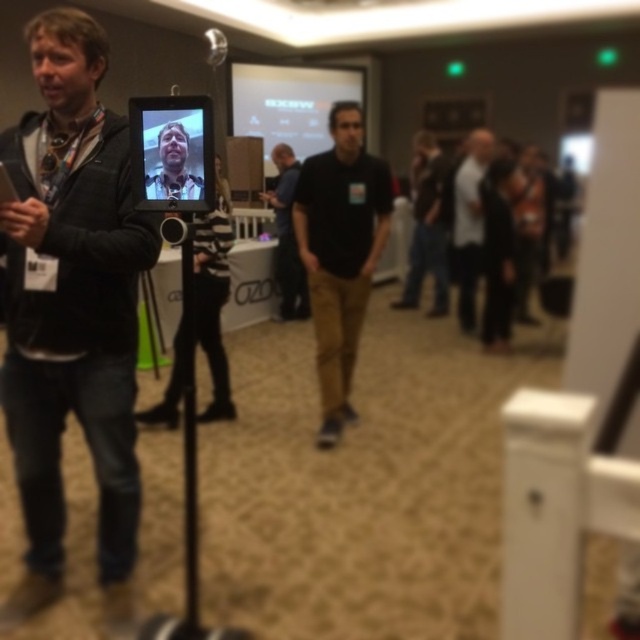
You are standing in the conference room and want to take a photo of both the black matte shirt at center and the black plastic tripod at center without any obstruction. Which object should you position closer to the camera to ensure both are fully visible?

The black matte shirt at center is closer to the viewer than the black plastic tripod at center, so positioning it closer to the camera will ensure both objects are fully visible without obstruction.

You are organizing a photo shoot at this event and need to ensure that the matte black tablet at center and the dark gray shirt at center are both visible in the frame. Given their sizes, which object might require adjusting the camera angle to avoid being too small in the photo?

The matte black tablet at center has a lesser height compared to the dark gray shirt at center, so it might require adjusting the camera angle to avoid being too small in the photo.

You are organizing a photo shoot and need to position a spotlight exactly at the center of the black matte shirt at center. According to the coordinates provided, where should you aim the spotlight?

The spotlight should be aimed at point (339, 252) to center it on the black matte shirt at center.